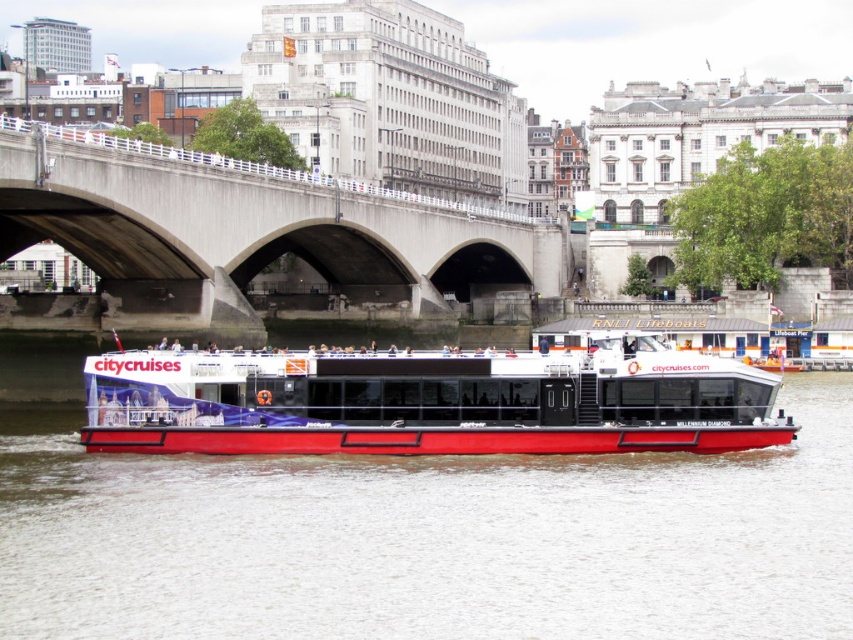
Based on the photo, can you confirm if concrete bridge at center is positioned to the left of red matte boat at center?

Yes, concrete bridge at center is to the left of red matte boat at center.

Which is in front, point (144, 202) or point (560, 452)?

Point (560, 452) is more forward.

Does point (107, 170) come behind point (543, 394)?

Yes.

At what (x,y) coordinates should I click in order to perform the action: click on concrete bridge at center. Please return your answer as a coordinate pair (x, y). Looking at the image, I should click on (247, 237).

Can you confirm if red matte water at center is thinner than concrete bridge at center?

In fact, red matte water at center might be wider than concrete bridge at center.

This screenshot has height=640, width=853. What are the coordinates of `red matte water at center` in the screenshot? It's located at (430, 540).

Where is `red matte water at center`? red matte water at center is located at coordinates (430, 540).

Which of these two, red matte water at center or red matte boat at center, stands taller?

red matte boat at center is taller.

Identify the location of red matte water at center. The width and height of the screenshot is (853, 640). (430, 540).

Is point (338, 593) positioned behind point (689, 413)?

That is False.

Where is `red matte water at center`? red matte water at center is located at coordinates (430, 540).